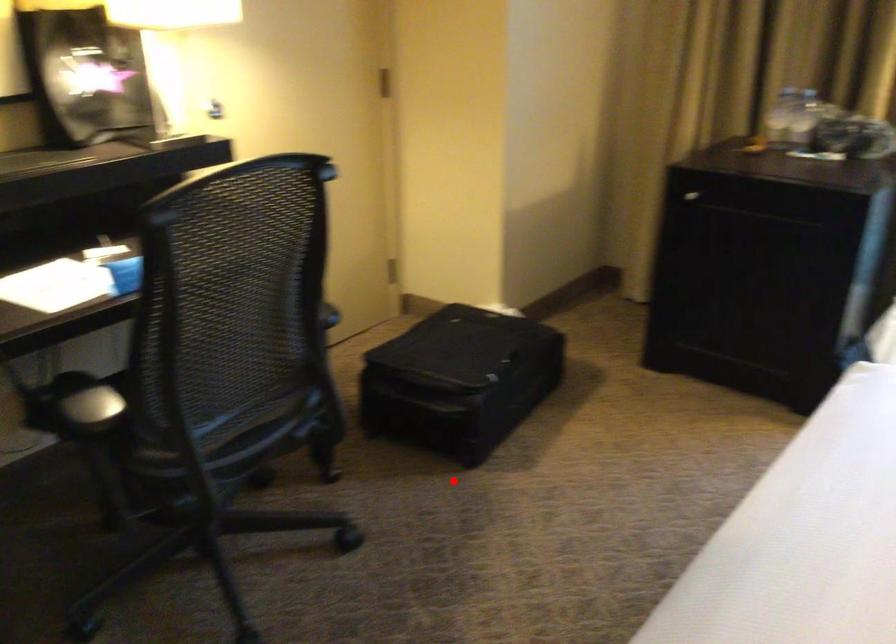
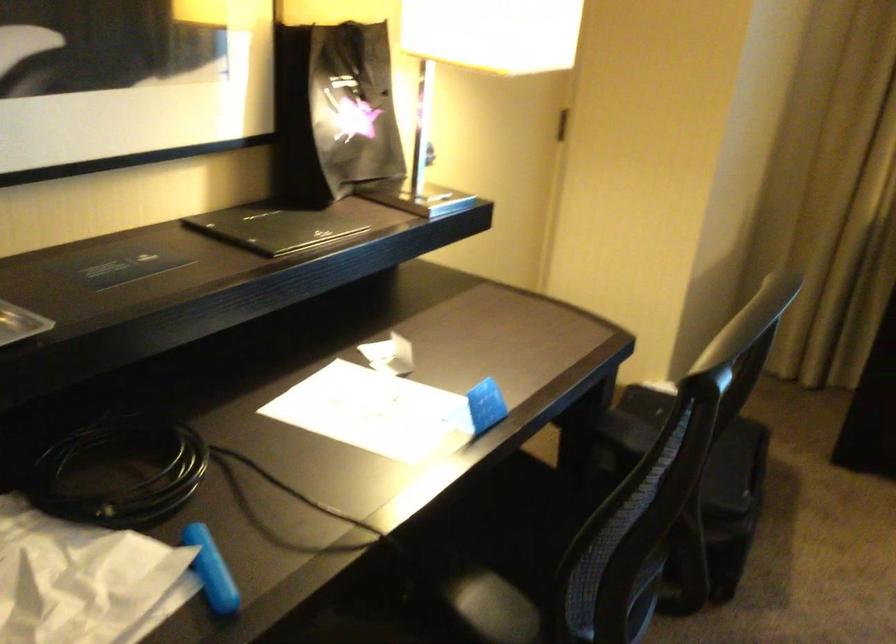
Question: A red point is marked in image1. In image2, is the corresponding 3D point closer to the camera or farther? Reply with the corresponding letter.

Choices:
 (A) The corresponding 3D point is closer.
 (B) The corresponding 3D point is farther.

Answer: (A)